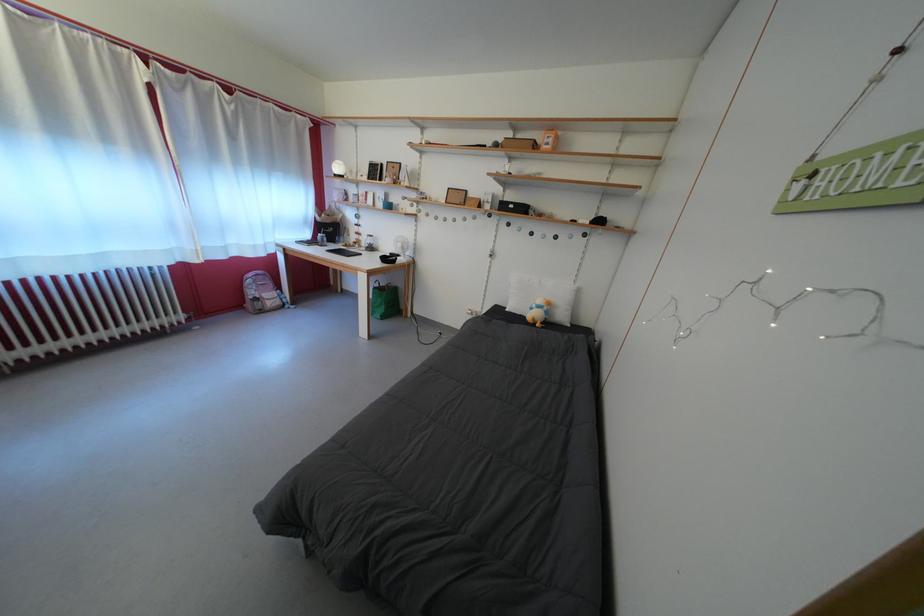
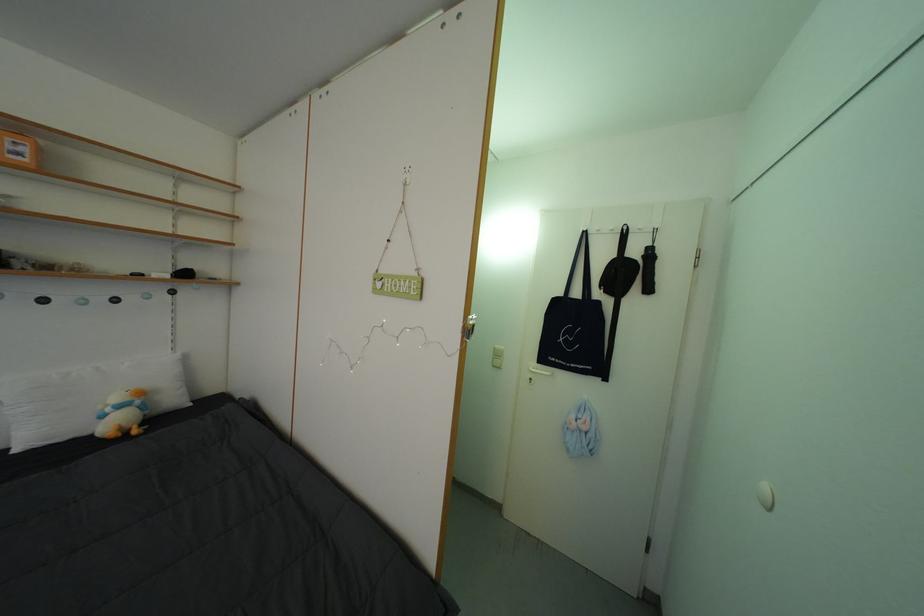
Find the pixel in the second image that matches point 542,312 in the first image.

(117, 415)